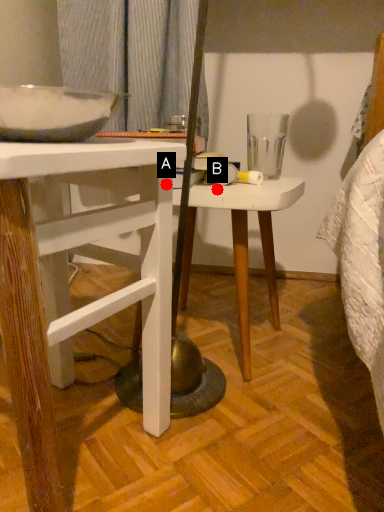
Question: Two points are circled on the image, labeled by A and B beside each circle. Among these points, which one is farthest from the camera?

Choices:
 (A) A is further
 (B) B is further

Answer: (B)